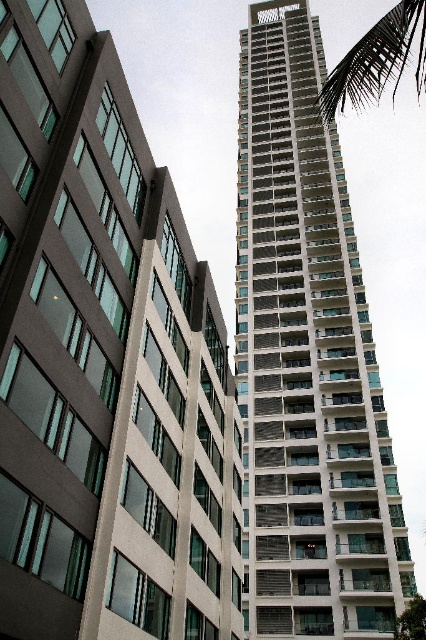
Question: Which of the following is the farthest from the observer?

Choices:
 (A) green leafy palm tree at upper right
 (B) white glass building at center

Answer: (B)

Question: Can you confirm if white glass building at center is positioned to the right of green leafy palm tree at upper right?

Choices:
 (A) yes
 (B) no

Answer: (B)

Question: Does white glass building at center have a greater width compared to green leafy palm tree at upper right?

Choices:
 (A) yes
 (B) no

Answer: (B)

Question: Is white glass building at center below green leafy palm tree at upper right?

Choices:
 (A) no
 (B) yes

Answer: (B)